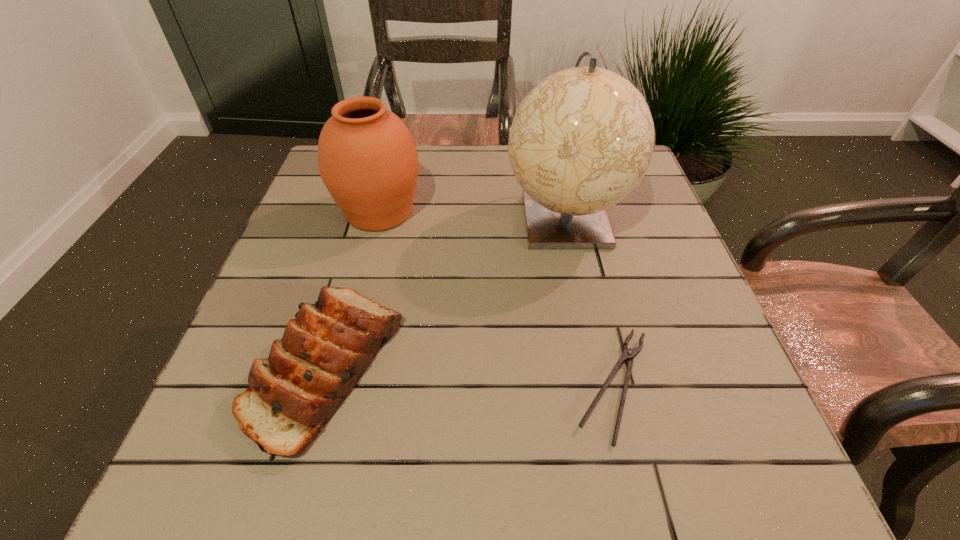
Locate an element on the screen. The height and width of the screenshot is (540, 960). free area in between the shortest object and the bread is located at coordinates (470, 376).

The height and width of the screenshot is (540, 960). I want to click on empty space that is in between the shortest object and the globe, so click(589, 302).

Identify the location of free point between the bread and the tongs. Image resolution: width=960 pixels, height=540 pixels. (470, 376).

Identify the location of vacant point located between the third shortest object and the tallest object. This screenshot has width=960, height=540. (472, 215).

Locate which object is the closest to the urn. Please provide its 2D coordinates. Your answer should be formatted as a tuple, i.e. [(x, y)], where the tuple contains the x and y coordinates of a point satisfying the conditions above.

[(324, 351)]

Choose which object is the second nearest neighbor to the urn. Please provide its 2D coordinates. Your answer should be formatted as a tuple, i.e. [(x, y)], where the tuple contains the x and y coordinates of a point satisfying the conditions above.

[(581, 140)]

Locate an element on the screen. The height and width of the screenshot is (540, 960). vacant space that satisfies the following two spatial constraints: 1. on the surface of the tallest object showing Europe and Africa; 2. on the left side of the shortest object is located at coordinates (600, 385).

You are a GUI agent. You are given a task and a screenshot of the screen. Output one action in this format:
    pyautogui.click(x=<x>, y=<y>)
    Task: Click on the free location that satisfies the following two spatial constraints: 1. on the back side of the urn; 2. on the right side of the second shortest object
    
    Given the screenshot: What is the action you would take?
    pyautogui.click(x=371, y=212)

Where is `blank space that satisfies the following two spatial constraints: 1. on the front side of the tongs; 2. on the left side of the third shortest object`? blank space that satisfies the following two spatial constraints: 1. on the front side of the tongs; 2. on the left side of the third shortest object is located at coordinates (335, 385).